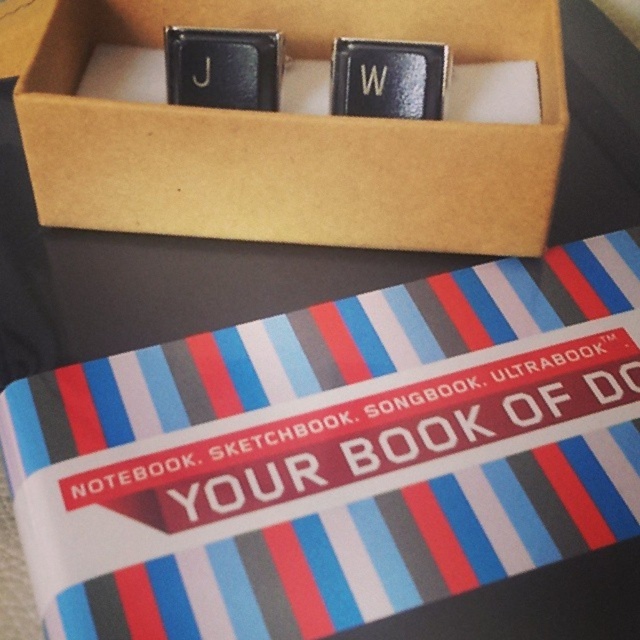
You have a striped paper notebook at center and a brown cardboard box at upper center on a desk. You need to place a new item between them. Which object should you place the new item closer to if the new item is wider than both?

The striped paper notebook at center has a larger width than the brown cardboard box at upper center. Since the new item is wider than both, it should be placed closer to the striped paper notebook at center to accommodate its width.

Looking at this image, you are organizing items on a desk and need to place a new item between the striped paper notebook at center and the brown cardboard box at upper center. Where should you place it to ensure it is between them spatially?

Place the new item between the striped paper notebook at center and the brown cardboard box at upper center so that it is behind the striped paper notebook at center but in front of the brown cardboard box at upper center, since the striped paper notebook at center is in front of the brown cardboard box at upper center.

You are standing in a room and see the striped paper notebook at center on a table. You want to pick it up without moving closer. Can you reach it if your outstretched hand can reach 1 meter?

The striped paper notebook at center is 1.08 meters away from you. Since your hand can only reach 1 meter, you cannot reach it without moving closer.